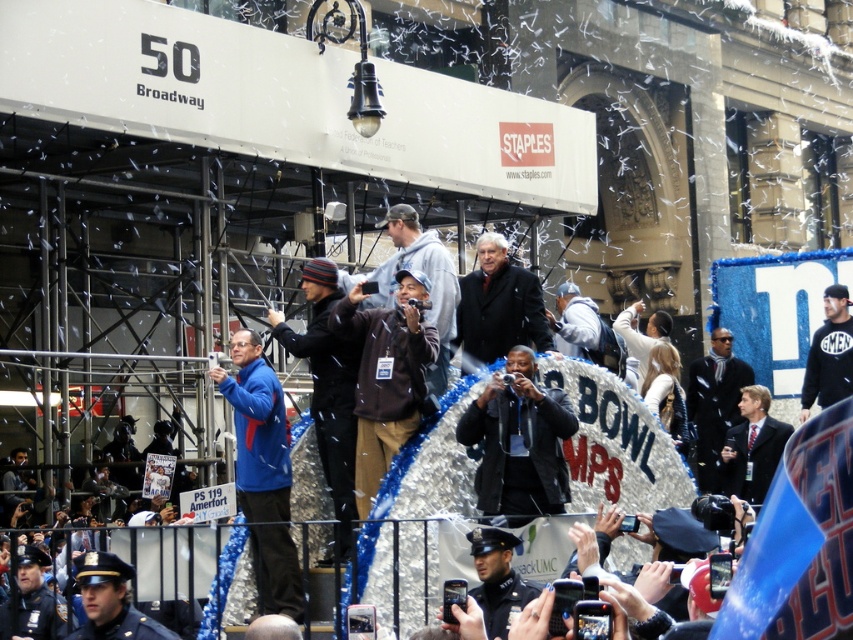
Is black leather jacket at center to the right of dark gray hoodie at center from the viewer's perspective?

Correct, you'll find black leather jacket at center to the right of dark gray hoodie at center.

Which is behind, point (502, 492) or point (418, 257)?

The point (418, 257) is behind.

Find the location of a particular element. black leather jacket at center is located at coordinates (519, 442).

Locate an element on the screen. The image size is (853, 640). black leather jacket at center is located at coordinates (519, 442).

Who is lower down, uniformed officer at lower left or dark suit at center?

Positioned lower is uniformed officer at lower left.

From the picture: Is uniformed officer at lower left further to camera compared to dark suit at center?

That is False.

Is point (102, 628) behind point (764, 417)?

No.

Locate an element on the screen. uniformed officer at lower left is located at coordinates (109, 602).

Can you confirm if dark blue knit hat at center is bigger than dark gray suit at center?

No, dark blue knit hat at center is not bigger than dark gray suit at center.

Between dark blue knit hat at center and dark gray suit at center, which one appears on the left side from the viewer's perspective?

dark blue knit hat at center

Which is in front, point (323, 378) or point (741, 364)?

Positioned in front is point (323, 378).

What are the coordinates of `dark blue knit hat at center` in the screenshot? It's located at (328, 388).